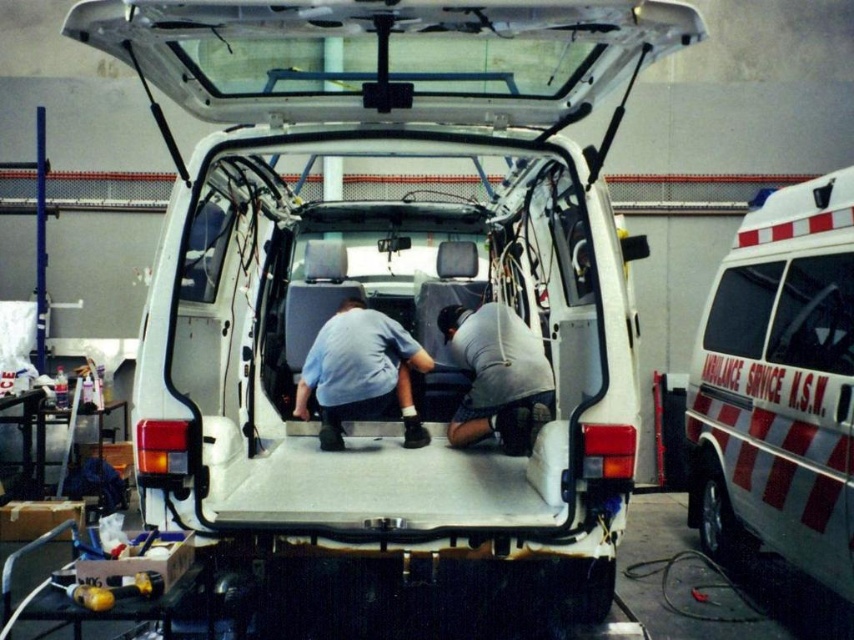
You are a delivery person trying to load a package into the van. The package is too heavy to lift over the gray matte shirt at center. Can you place it on top of the white glossy ambulance at right instead?

The white glossy ambulance at right is above the gray matte shirt at center, so yes, you can place the package on top of the white glossy ambulance at right since it is higher up and accessible.

You are a technician entering the workshop and need to identify which worker is closer to the van entrance. Based on the positions of the blue cotton shirt at center and the gray matte shirt at center, which one is nearer to you?

The blue cotton shirt at center is closer to you since it is positioned further toward the viewer compared to the gray matte shirt at center.

You are a delivery person trying to load a package into the van. You see the white glossy ambulance at right and the gray matte shirt at center. Which object is closer to the left side of the van?

The white glossy ambulance at right is positioned on the left side of gray matte shirt at center, so it is closer to the left side of the van.